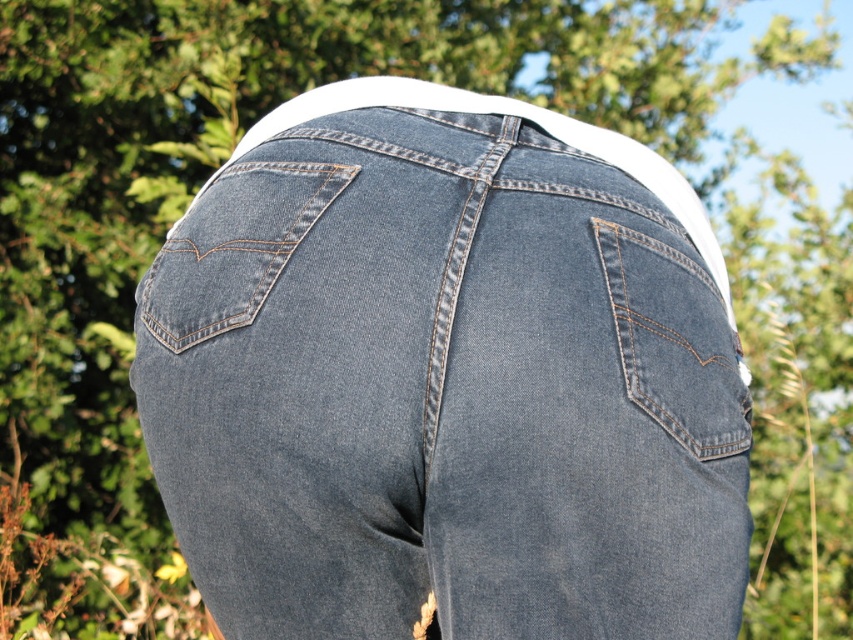
Question: Which is farther from the denim at left?

Choices:
 (A) denim at center
 (B) denim pocket at right

Answer: (B)

Question: Is denim at center closer to the viewer compared to denim pocket at right?

Choices:
 (A) no
 (B) yes

Answer: (B)

Question: Among these points, which one is nearest to the camera?

Choices:
 (A) (662, 426)
 (B) (216, 186)

Answer: (A)

Question: Is denim at center positioned before denim at left?

Choices:
 (A) no
 (B) yes

Answer: (B)

Question: Does denim at center appear under denim pocket at right?

Choices:
 (A) yes
 (B) no

Answer: (A)

Question: Which point is closer to the camera?

Choices:
 (A) denim pocket at right
 (B) denim at center

Answer: (B)